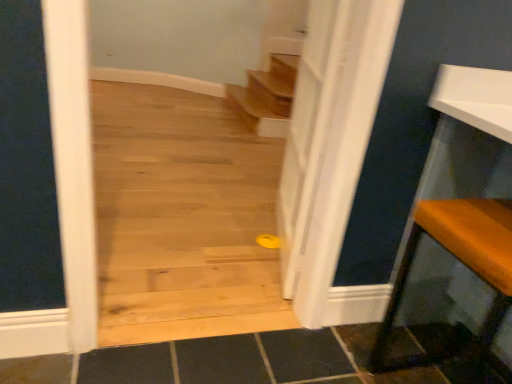
Question: Is orange fabric cushion at right wider than white glossy door at center?

Choices:
 (A) yes
 (B) no

Answer: (A)

Question: From a real-world perspective, is orange fabric cushion at right on top of white glossy door at center?

Choices:
 (A) no
 (B) yes

Answer: (A)

Question: Would you say white glossy door at center is part of orange fabric cushion at right's contents?

Choices:
 (A) yes
 (B) no

Answer: (B)

Question: Is orange fabric cushion at right turned away from white glossy door at center?

Choices:
 (A) yes
 (B) no

Answer: (B)

Question: Is orange fabric cushion at right not near white glossy door at center?

Choices:
 (A) no
 (B) yes

Answer: (A)

Question: Is orange fabric cushion at right beside white glossy door at center?

Choices:
 (A) no
 (B) yes

Answer: (A)

Question: Does white glossy door at center have a lesser width compared to orange fabric cushion at right?

Choices:
 (A) yes
 (B) no

Answer: (A)

Question: Can you confirm if white glossy door at center is wider than orange fabric cushion at right?

Choices:
 (A) yes
 (B) no

Answer: (B)

Question: Is white glossy door at center beside orange fabric cushion at right?

Choices:
 (A) no
 (B) yes

Answer: (A)

Question: Is white glossy door at center not inside orange fabric cushion at right?

Choices:
 (A) yes
 (B) no

Answer: (A)

Question: Considering the relative sizes of white glossy door at center and orange fabric cushion at right in the image provided, is white glossy door at center bigger than orange fabric cushion at right?

Choices:
 (A) yes
 (B) no

Answer: (B)

Question: From a real-world perspective, is white glossy door at center on orange fabric cushion at right?

Choices:
 (A) no
 (B) yes

Answer: (B)

Question: Looking at the image, does white glossy door at center seem bigger or smaller compared to orange fabric cushion at right?

Choices:
 (A) big
 (B) small

Answer: (B)